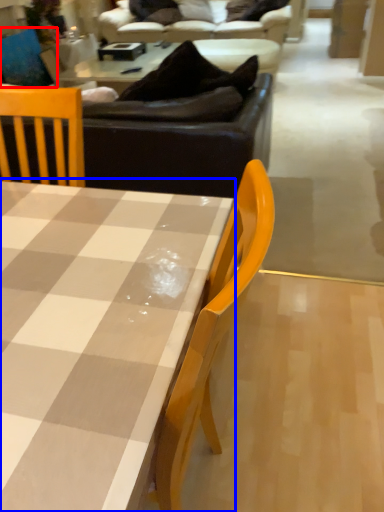
Question: Which of the following is the farthest to the observer, swivel chair (highlighted by a red box) or coffee table (highlighted by a blue box)?

Choices:
 (A) swivel chair
 (B) coffee table

Answer: (A)